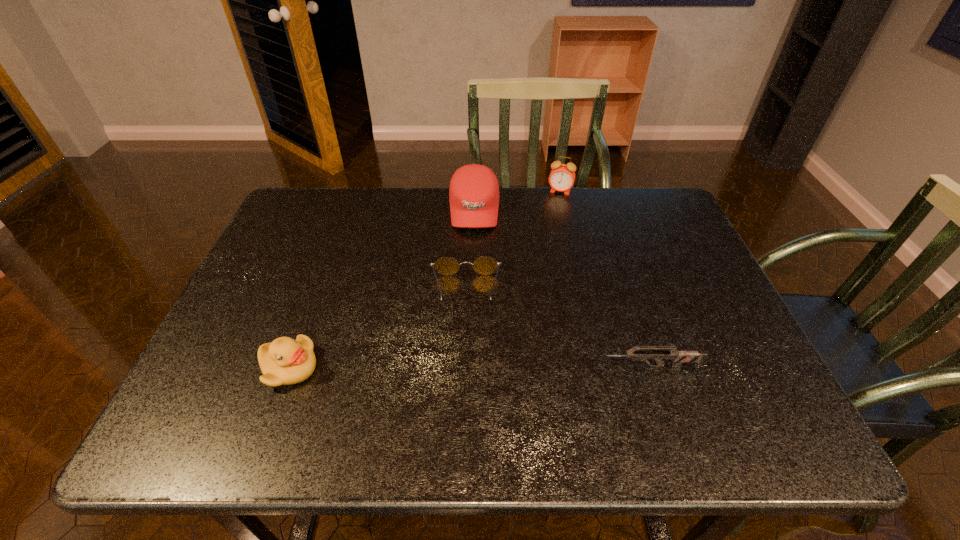
Identify the location of vacant space at the far left corner. The width and height of the screenshot is (960, 540). (326, 212).

Identify the location of vacant region at the far right corner of the desktop. The width and height of the screenshot is (960, 540). (652, 228).

Locate an element on the screen. free spot between the alarm clock and the gun is located at coordinates (605, 279).

The height and width of the screenshot is (540, 960). Identify the location of free space between the third tallest object and the alarm clock. (424, 279).

Identify the location of empty location between the cap and the spectacles. (470, 251).

You are a GUI agent. You are given a task and a screenshot of the screen. Output one action in this format:
    pyautogui.click(x=<x>, y=<y>)
    Task: Click on the empty space that is in between the gun and the cap
    
    Given the screenshot: What is the action you would take?
    pyautogui.click(x=562, y=288)

At what (x,y) coordinates should I click in order to perform the action: click on vacant point located between the alarm clock and the gun. Please return your answer as a coordinate pair (x, y). Looking at the image, I should click on [x=605, y=279].

At what (x,y) coordinates should I click in order to perform the action: click on unoccupied position between the alarm clock and the duckling. Please return your answer as a coordinate pair (x, y). The image size is (960, 540). Looking at the image, I should click on tap(424, 279).

You are a GUI agent. You are given a task and a screenshot of the screen. Output one action in this format:
    pyautogui.click(x=<x>, y=<y>)
    Task: Click on the free space between the third tallest object and the gun
    
    Given the screenshot: What is the action you would take?
    pyautogui.click(x=469, y=367)

You are a GUI agent. You are given a task and a screenshot of the screen. Output one action in this format:
    pyautogui.click(x=<x>, y=<y>)
    Task: Click on the free spot between the cap and the spectacles
    
    Given the screenshot: What is the action you would take?
    pyautogui.click(x=470, y=251)